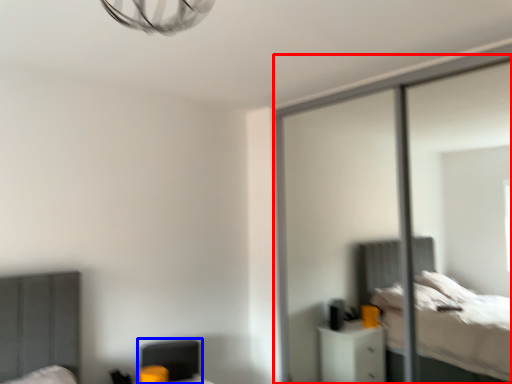
Question: Which of the following is the closest to the observer, screen door (highlighted by a red box) or swivel chair (highlighted by a blue box)?

Choices:
 (A) screen door
 (B) swivel chair

Answer: (A)